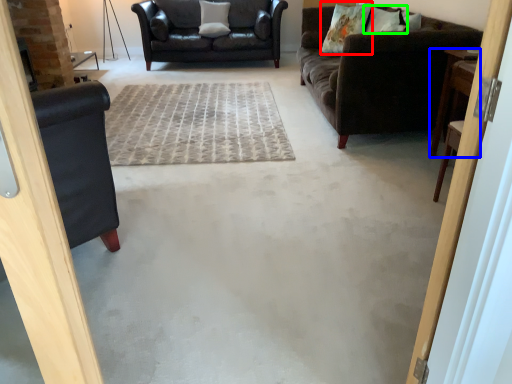
Question: Which object is the closest to the pillow (highlighted by a red box)? Choose among these: table (highlighted by a blue box) or pillow (highlighted by a green box).

Choices:
 (A) table
 (B) pillow

Answer: (B)